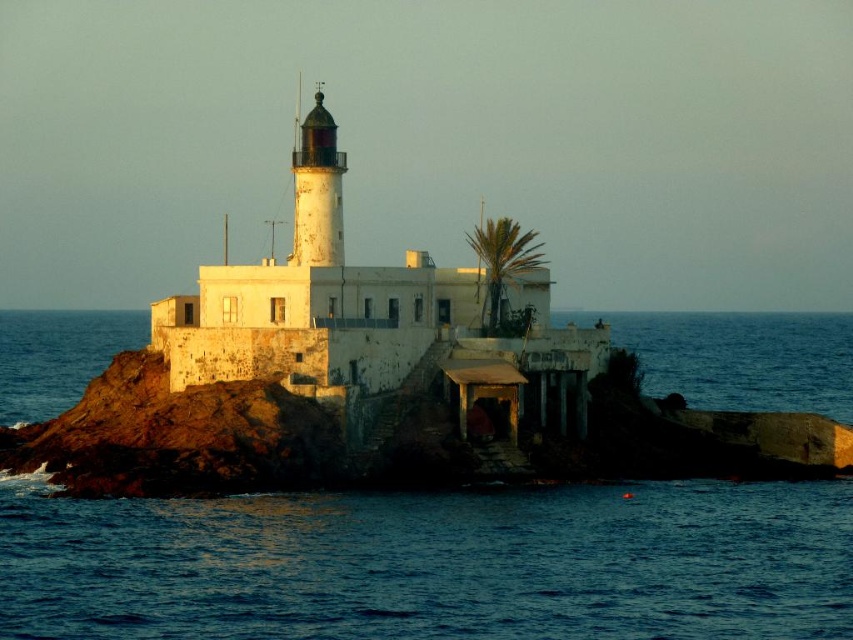
Question: Is dark blue water at lower left thinner than green leafy palm at upper center?

Choices:
 (A) yes
 (B) no

Answer: (B)

Question: Does blue water at center have a lesser width compared to polished brass lighthouse at center?

Choices:
 (A) yes
 (B) no

Answer: (B)

Question: Estimate the real-world distances between objects in this image. Which object is closer to the green leafy palm at upper center?

Choices:
 (A) dark blue water at lower left
 (B) blue water at center
 (C) polished brass lighthouse at center

Answer: (A)

Question: Which object is positioned farthest from the polished brass lighthouse at center?

Choices:
 (A) green leafy palm at upper center
 (B) blue water at center
 (C) dark blue water at lower left

Answer: (B)

Question: Does dark blue water at lower left have a lesser width compared to green leafy palm at upper center?

Choices:
 (A) no
 (B) yes

Answer: (A)

Question: Which object is farther from the camera taking this photo?

Choices:
 (A) blue water at center
 (B) polished brass lighthouse at center
 (C) dark blue water at lower left
 (D) green leafy palm at upper center

Answer: (D)